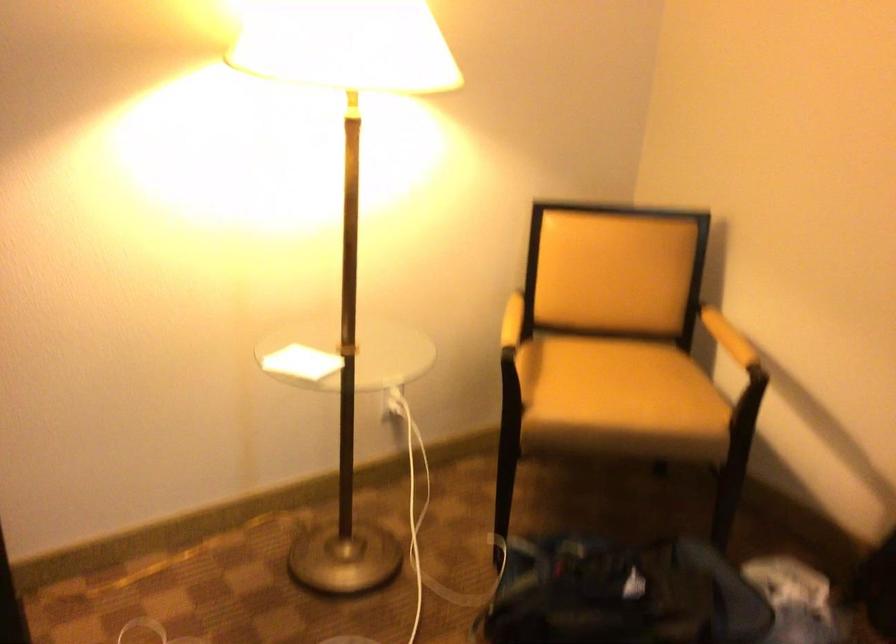
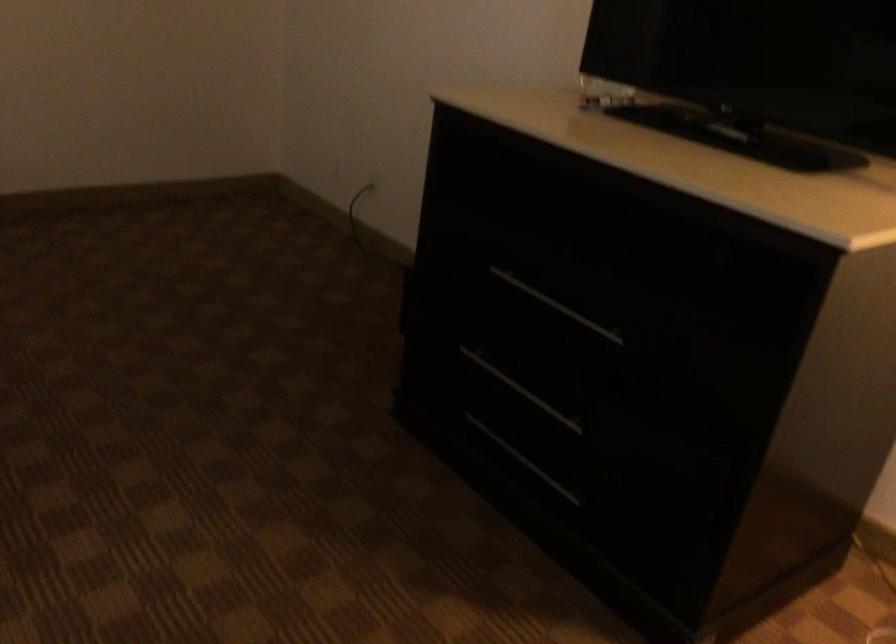
Based on the continuous images, in which direction is the camera rotating?

The camera rotated toward left-down.